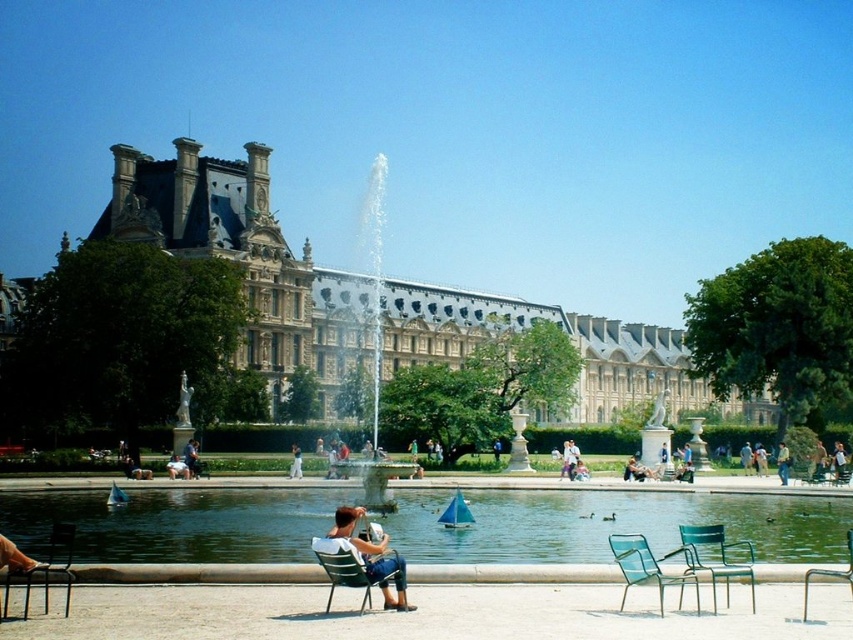
Who is lower down, white fabric shirt at lower center or green fabric shirt at center?

white fabric shirt at lower center is lower down.

Where is `white fabric shirt at lower center`? This screenshot has width=853, height=640. white fabric shirt at lower center is located at coordinates (177, 467).

This screenshot has width=853, height=640. Describe the element at coordinates (782, 461) in the screenshot. I see `green fabric jacket at center` at that location.

Who is lower down, green fabric jacket at center or white fabric shirt at center?

Positioned lower is white fabric shirt at center.

Who is more forward, [786,472] or [746,474]?

Point [786,472] is in front.

Image resolution: width=853 pixels, height=640 pixels. Identify the location of green fabric jacket at center. (782, 461).

Between point (28, 566) and point (181, 476), which one is positioned in front?

Point (28, 566) is more forward.

Consider the image. Between smooth tan skin at lower left and white fabric shirt at lower center, which one is positioned lower?

smooth tan skin at lower left is below.

At what (x,y) coordinates should I click in order to perform the action: click on smooth tan skin at lower left. Please return your answer as a coordinate pair (x, y). The height and width of the screenshot is (640, 853). Looking at the image, I should click on (15, 557).